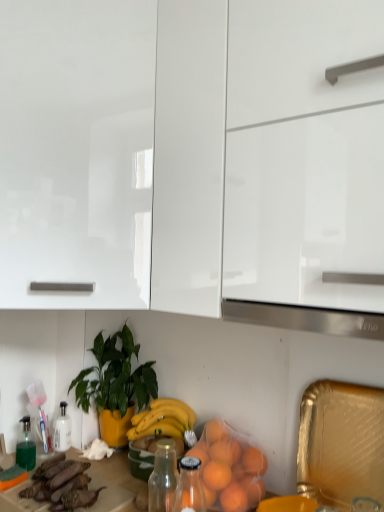
Question: Can you confirm if orange matte plastic bag at lower center is taller than purple matte eggplant at lower left?

Choices:
 (A) no
 (B) yes

Answer: (B)

Question: From the image's perspective, does orange matte plastic bag at lower center appear lower than purple matte eggplant at lower left?

Choices:
 (A) yes
 (B) no

Answer: (B)

Question: Considering the relative positions of orange matte plastic bag at lower center and purple matte eggplant at lower left in the image provided, is orange matte plastic bag at lower center in front of purple matte eggplant at lower left?

Choices:
 (A) yes
 (B) no

Answer: (A)

Question: Does orange matte plastic bag at lower center have a smaller size compared to purple matte eggplant at lower left?

Choices:
 (A) no
 (B) yes

Answer: (A)

Question: Would you say purple matte eggplant at lower left is part of orange matte plastic bag at lower center's contents?

Choices:
 (A) no
 (B) yes

Answer: (A)

Question: Is orange matte plastic bag at lower center not inside purple matte eggplant at lower left?

Choices:
 (A) no
 (B) yes

Answer: (B)

Question: Is satin silver exhaust hood at center in front of glossy white cabinet at upper left, which is the 1th cabinetry from left to right?

Choices:
 (A) no
 (B) yes

Answer: (B)

Question: Does satin silver exhaust hood at center have a lesser width compared to glossy white cabinet at upper left, which is the 1th cabinetry from left to right?

Choices:
 (A) yes
 (B) no

Answer: (A)

Question: Is satin silver exhaust hood at center to the left of glossy white cabinet at upper left, which is the 1th cabinetry from left to right, from the viewer's perspective?

Choices:
 (A) no
 (B) yes

Answer: (A)

Question: Would you say satin silver exhaust hood at center is a long distance from glossy white cabinet at upper left, which is the 1th cabinetry from left to right?

Choices:
 (A) no
 (B) yes

Answer: (A)

Question: Can you confirm if satin silver exhaust hood at center is smaller than glossy white cabinet at upper left, which is the 1th cabinetry from left to right?

Choices:
 (A) yes
 (B) no

Answer: (A)

Question: Is satin silver exhaust hood at center further to the viewer compared to glossy white cabinet at upper left, which is the 1th cabinetry from left to right?

Choices:
 (A) no
 (B) yes

Answer: (A)

Question: From the image's perspective, does glossy white cabinet at upper left, the 2th cabinetry in the right-to-left sequence, appear higher than green glossy plant at center?

Choices:
 (A) yes
 (B) no

Answer: (A)